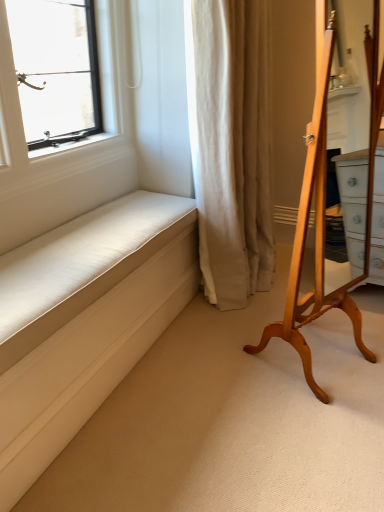
At what (x,y) coordinates should I click in order to perform the action: click on blank space situated above white fabric cushion at lower left (from a real-world perspective). Please return your answer as a coordinate pair (x, y). This screenshot has height=512, width=384. Looking at the image, I should click on (84, 240).